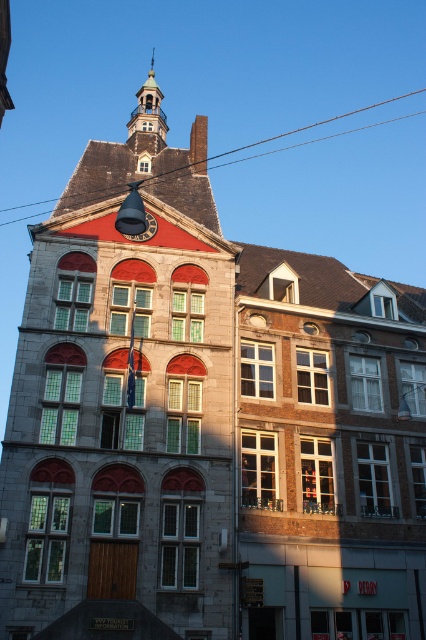
You are standing in front of a historic building with a mix of stone and brick exterior. You notice a specific point marked at coordinates point (49, 577). Considering your distance from this point, would you estimate that you are closer to the building or farther away than 100 feet?

The point (49, 577) is 110.03 feet away from the viewer, so you are farther away than 100 feet from the building.

You are an architect inspecting the building. You notice the polished brass bell tower at center and the gold polished metal spire at upper center. Which of these two features is positioned higher up on the building?

The gold polished metal spire at upper center is positioned higher up on the building than the polished brass bell tower at center.

You are standing in front of a historic building and want to take a photo that includes the polished brass bell tower at center. If your camera has a maximum focus range of 25 meters, will you be able to capture the bell tower clearly?

The distance between the polished brass bell tower at center and the camera is 25.60 meters, which exceeds the camera maximum focus range of 25 meters. Therefore, the camera cannot focus on the bell tower clearly.